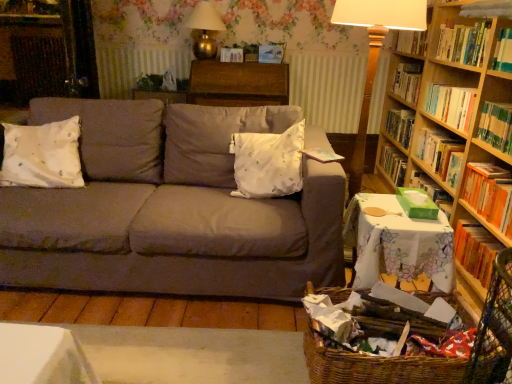
Question: Is wooden table at center, the second table viewed from the front, bigger than hardcover book at right, which ranks as the first book in bottom-to-top order?

Choices:
 (A) yes
 (B) no

Answer: (A)

Question: From the image's perspective, is wooden table at center, the second table viewed from the front, under hardcover book at right, which is counted as the 4th book, starting from the top?

Choices:
 (A) yes
 (B) no

Answer: (B)

Question: Could you tell me if wooden table at center, which ranks as the 1th table in left-to-right order, is facing hardcover book at right, which is counted as the 4th book, starting from the top?

Choices:
 (A) no
 (B) yes

Answer: (A)

Question: Is wooden table at center, marked as the 2th table in a bottom-to-top arrangement, at the left side of hardcover book at right, which ranks as the first book in bottom-to-top order?

Choices:
 (A) yes
 (B) no

Answer: (A)

Question: Is wooden table at center, which ranks as the first table in back-to-front order, wider than hardcover book at right, which ranks as the first book in bottom-to-top order?

Choices:
 (A) yes
 (B) no

Answer: (A)

Question: In terms of size, does hardcover book at right, the third book ordered from the bottom, appear bigger or smaller than matte gray couch at center?

Choices:
 (A) big
 (B) small

Answer: (B)

Question: Would you say hardcover book at right, the third book ordered from the bottom, is to the left or to the right of matte gray couch at center in the picture?

Choices:
 (A) left
 (B) right

Answer: (B)

Question: Is hardcover book at right, positioned as the 2th book in top-to-bottom order, wider or thinner than matte gray couch at center?

Choices:
 (A) thin
 (B) wide

Answer: (A)

Question: Does point (487, 109) appear closer or farther from the camera than point (250, 117)?

Choices:
 (A) farther
 (B) closer

Answer: (B)

Question: In terms of height, does hardcover book at right, the third book ordered from the bottom, look taller or shorter compared to white floral tablecloth at lower right, positioned as the second table in back-to-front order?

Choices:
 (A) tall
 (B) short

Answer: (B)

Question: Is point (483, 115) positioned closer to the camera than point (400, 256)?

Choices:
 (A) closer
 (B) farther

Answer: (B)

Question: Is hardcover book at right, the third book ordered from the bottom, inside the boundaries of white floral tablecloth at lower right, which is the second table from left to right, or outside?

Choices:
 (A) outside
 (B) inside

Answer: (A)

Question: From a real-world perspective, is hardcover book at right, positioned as the 2th book in top-to-bottom order, positioned above or below white floral tablecloth at lower right, positioned as the second table in back-to-front order?

Choices:
 (A) above
 (B) below

Answer: (A)

Question: From the image's perspective, is hardcover book at right, which ranks as the first book in bottom-to-top order, positioned above or below hardwood bookshelf at upper right?

Choices:
 (A) below
 (B) above

Answer: (A)

Question: Choose the correct answer: Is hardcover book at right, which is counted as the 4th book, starting from the top, inside hardwood bookshelf at upper right or outside it?

Choices:
 (A) inside
 (B) outside

Answer: (B)